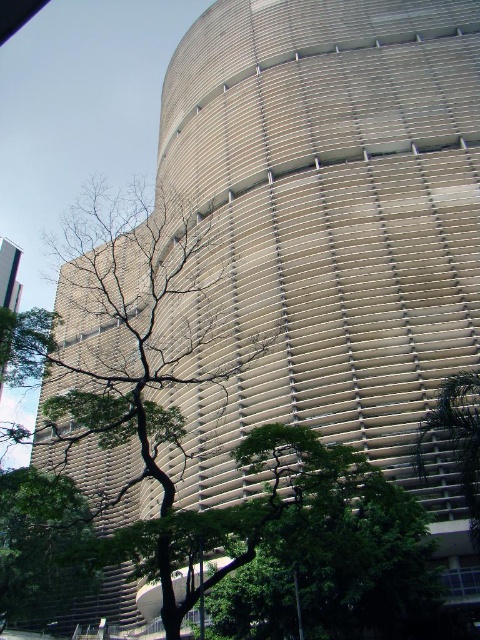
Question: Is green leafy tree at center below green leafy tree at lower right?

Choices:
 (A) no
 (B) yes

Answer: (A)

Question: Does green leafy tree at center have a lesser width compared to green leafy tree at lower right?

Choices:
 (A) yes
 (B) no

Answer: (B)

Question: Is green leafy tree at center smaller than green leafy tree at lower right?

Choices:
 (A) no
 (B) yes

Answer: (A)

Question: Which point is closer to the camera taking this photo?

Choices:
 (A) (146, 282)
 (B) (468, 401)

Answer: (B)

Question: Which point is farther from the camera taking this photo?

Choices:
 (A) (182, 472)
 (B) (470, 509)

Answer: (A)

Question: Which of the following is the closest to the observer?

Choices:
 (A) green leafy tree at center
 (B) green leafy tree at lower right

Answer: (A)